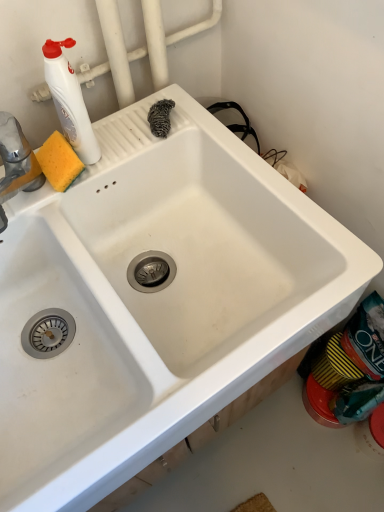
You are a GUI agent. You are given a task and a screenshot of the screen. Output one action in this format:
    pyautogui.click(x=<x>, y=<y>)
    Task: Click on the free location to the right of white plastic bottle at upper left
    
    Given the screenshot: What is the action you would take?
    tap(150, 135)